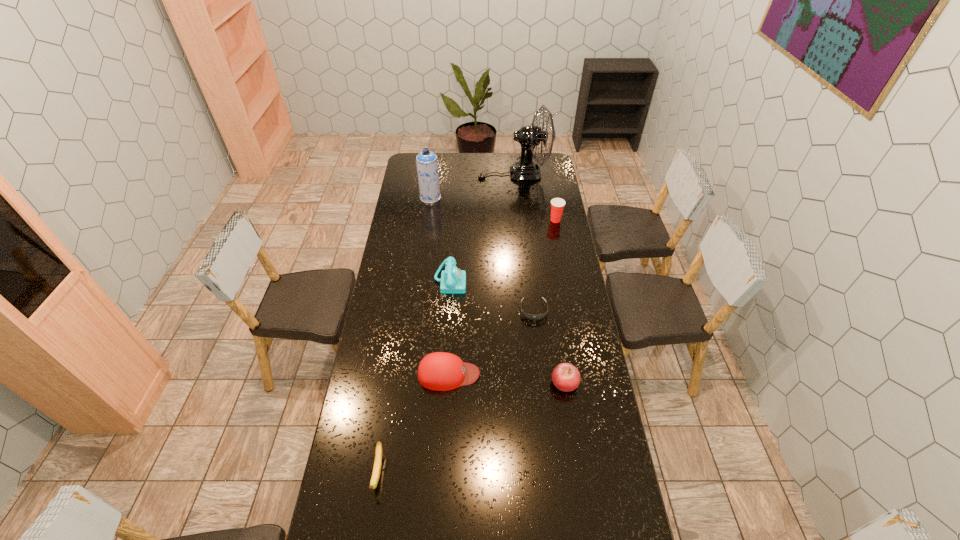
The width and height of the screenshot is (960, 540). I want to click on free location located at the stem of the second shortest object, so click(x=369, y=534).

Identify the location of vacant region located on the lenses of the fifth farthest object. (539, 349).

At what (x,y) coordinates should I click in order to perform the action: click on object situated at the far edge. Please return your answer as a coordinate pair (x, y). The image size is (960, 540). Looking at the image, I should click on (529, 136).

The image size is (960, 540). In order to click on aerosol can that is at the left edge in this screenshot , I will do [x=426, y=161].

The image size is (960, 540). In order to click on banana that is at the left edge in this screenshot , I will do point(378,452).

Locate an element on the screen. fan that is at the right edge is located at coordinates (529, 136).

Where is `Dixie cup at the right edge`? Dixie cup at the right edge is located at coordinates (557, 204).

I want to click on apple that is at the right edge, so click(x=565, y=376).

You are a GUI agent. You are given a task and a screenshot of the screen. Output one action in this format:
    pyautogui.click(x=<x>, y=<y>)
    Task: Click on the goggles that is at the right edge
    The width and height of the screenshot is (960, 540).
    Given the screenshot: What is the action you would take?
    pyautogui.click(x=529, y=316)

What are the coordinates of `object that is at the far right corner` in the screenshot? It's located at (529, 136).